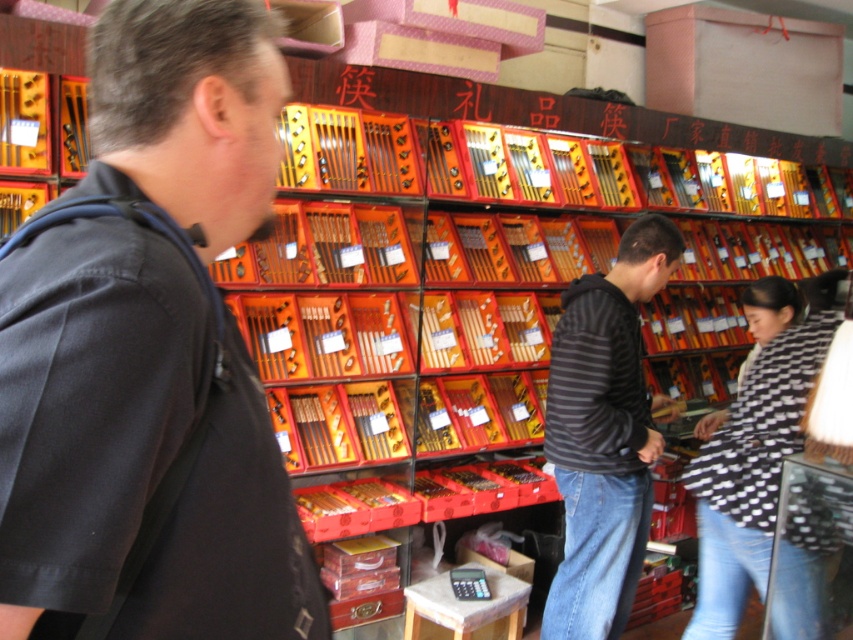
Question: Which of these objects is positioned closest to the black and white checkered shirt at lower right?

Choices:
 (A) black matte shirt at left
 (B) striped hoodie at center

Answer: (B)

Question: Which object is closer to the camera taking this photo?

Choices:
 (A) striped hoodie at center
 (B) black and white checkered shirt at lower right
 (C) black matte shirt at left

Answer: (C)

Question: Does striped hoodie at center appear under black and white checkered shirt at lower right?

Choices:
 (A) yes
 (B) no

Answer: (A)

Question: Does black matte shirt at left appear on the left side of black and white checkered shirt at lower right?

Choices:
 (A) yes
 (B) no

Answer: (A)

Question: Based on their relative distances, which object is farther from the black and white checkered shirt at lower right?

Choices:
 (A) striped hoodie at center
 (B) black matte shirt at left

Answer: (B)

Question: Is black matte shirt at left below black and white checkered shirt at lower right?

Choices:
 (A) yes
 (B) no

Answer: (B)